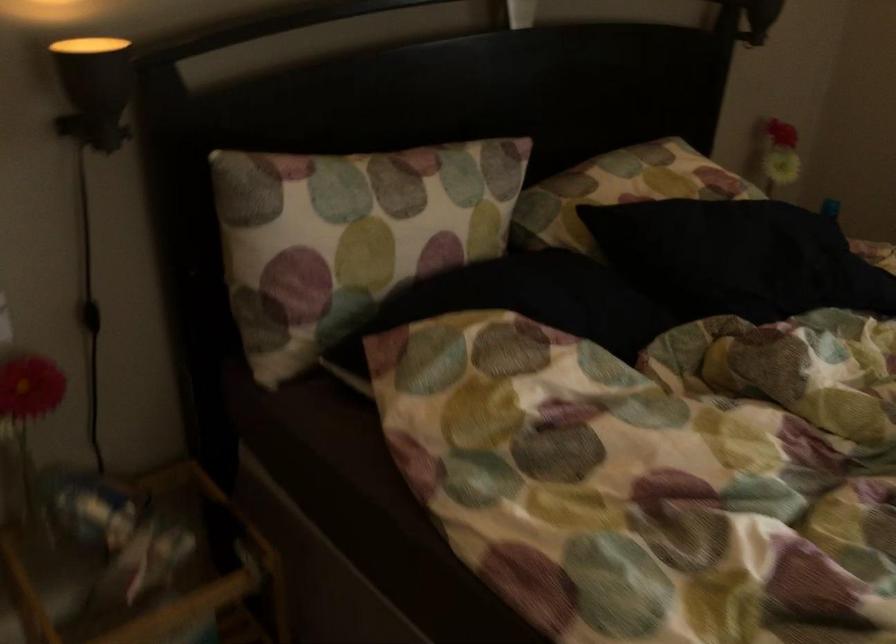
The height and width of the screenshot is (644, 896). I want to click on black lamp head, so click(x=90, y=48).